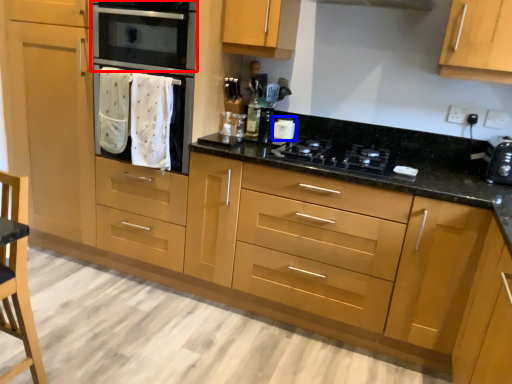
Question: Which point is closer to the camera, home appliance (highlighted by a red box) or kitchen appliance (highlighted by a blue box)?

Choices:
 (A) home appliance
 (B) kitchen appliance

Answer: (A)